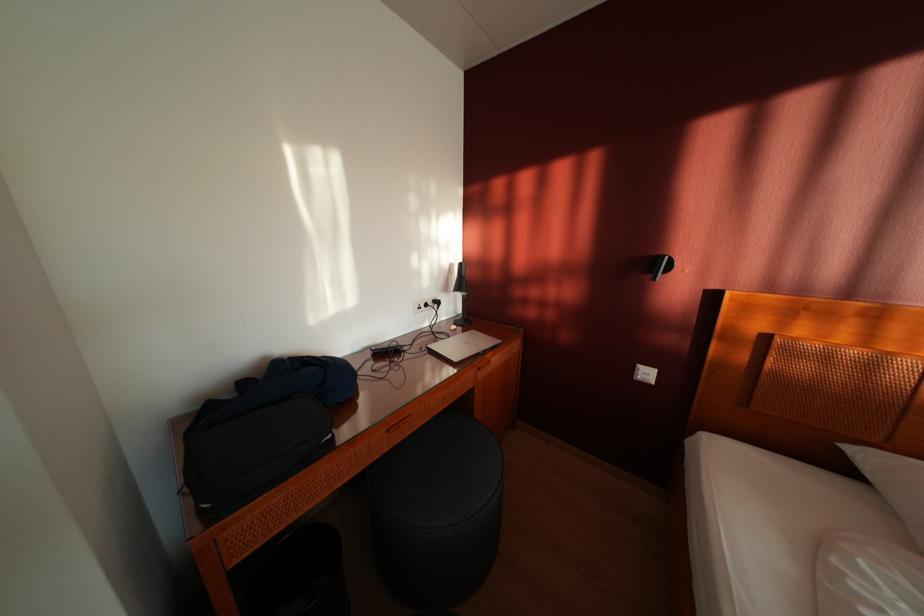
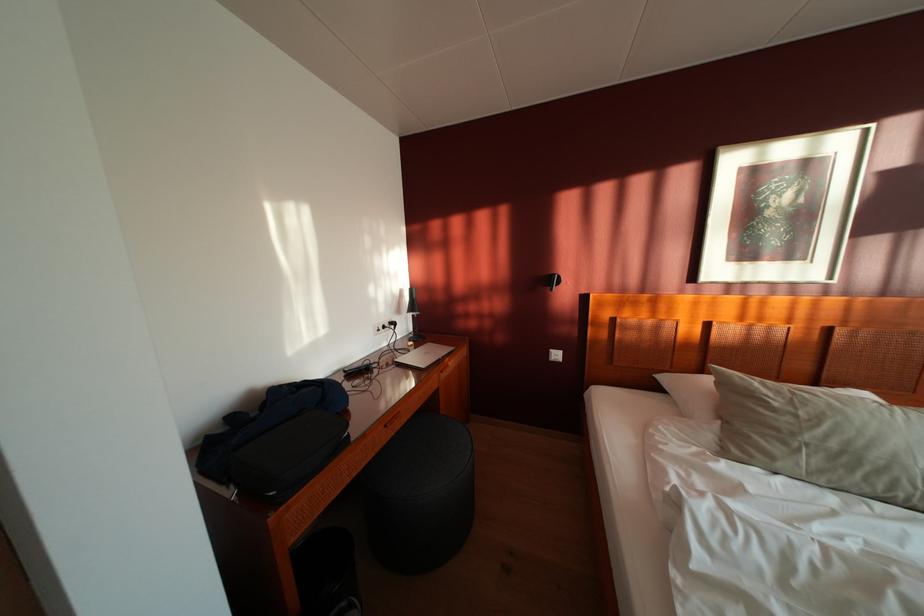
Where in the second image is the point corresponding to [207,413] from the first image?

(208, 448)